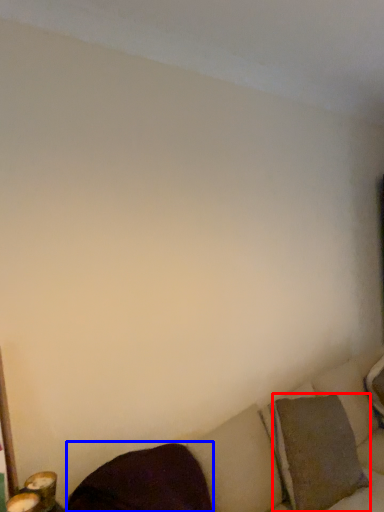
Question: Among these objects, which one is nearest to the camera, pillow (highlighted by a red box) or pillow (highlighted by a blue box)?

Choices:
 (A) pillow
 (B) pillow

Answer: (B)